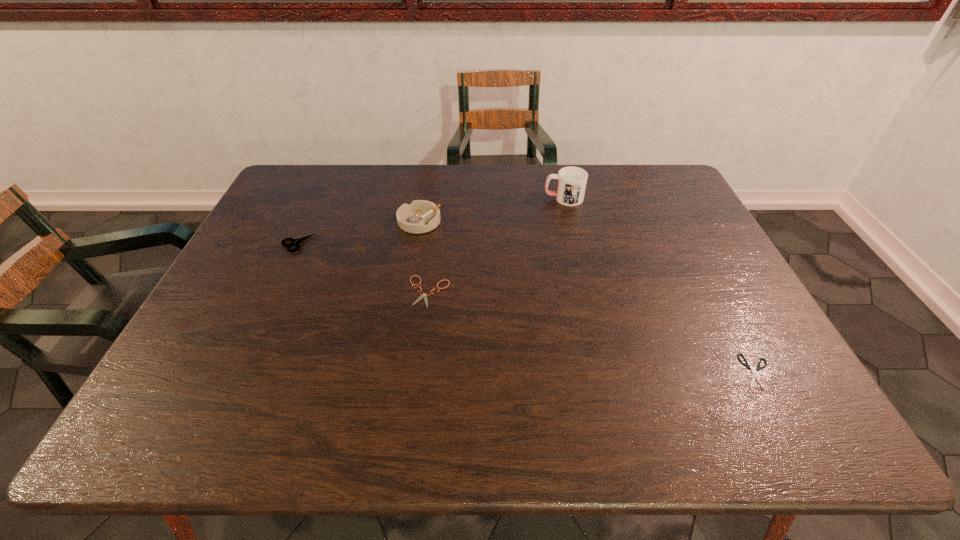
The width and height of the screenshot is (960, 540). What are the coordinates of `vacant space at the near edge` in the screenshot? It's located at (539, 419).

The image size is (960, 540). Identify the location of vacant area at the left edge of the desktop. (241, 262).

Locate an element on the screen. The image size is (960, 540). vacant space at the right edge of the desktop is located at coordinates (662, 206).

Locate an element on the screen. The height and width of the screenshot is (540, 960). free region at the far right corner of the desktop is located at coordinates (629, 168).

Find the location of `vacant point located between the farthest object and the second shortest object`. vacant point located between the farthest object and the second shortest object is located at coordinates (496, 245).

Find the location of a particular element. The width and height of the screenshot is (960, 540). empty space that is in between the second tallest shears and the leftmost object is located at coordinates (364, 267).

In order to click on vacant space that is in between the fourth tallest object and the rightmost object in this screenshot , I will do `click(593, 332)`.

The image size is (960, 540). Find the location of `empty space that is in between the ashtray and the second tallest shears`. empty space that is in between the ashtray and the second tallest shears is located at coordinates (424, 256).

You are a GUI agent. You are given a task and a screenshot of the screen. Output one action in this format:
    pyautogui.click(x=<x>, y=<y>)
    Task: Click on the free spot between the fourth object from left to right and the rightmost object
    Image resolution: width=960 pixels, height=540 pixels.
    Given the screenshot: What is the action you would take?
    pyautogui.click(x=660, y=285)

Where is `free space between the ashtray and the second nearest object`? free space between the ashtray and the second nearest object is located at coordinates (424, 256).